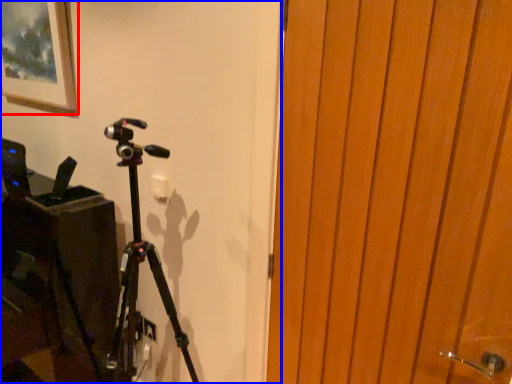
Question: Which object is closer to the camera taking this photo, picture frame (highlighted by a red box) or backdrop (highlighted by a blue box)?

Choices:
 (A) picture frame
 (B) backdrop

Answer: (B)